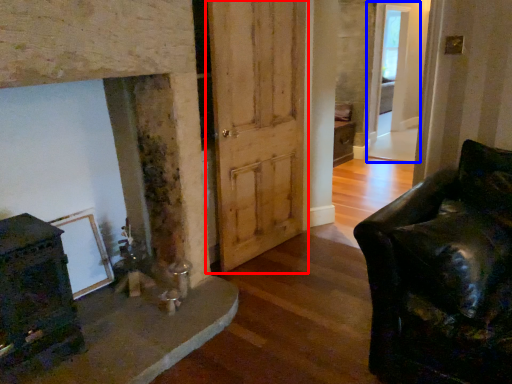
Question: Which object appears farthest to the camera in this image, barn door (highlighted by a red box) or glass door (highlighted by a blue box)?

Choices:
 (A) barn door
 (B) glass door

Answer: (B)